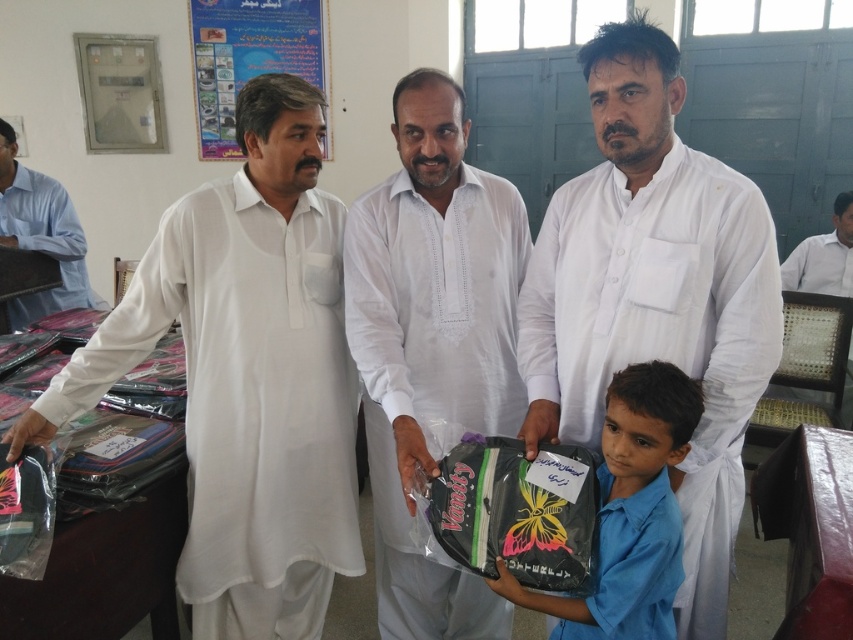
Based on the photo, you are standing in the classroom and need to place a small object exactly at the point closer to the camera between the two points, point 1 at coordinates (676, 189) and point 2 at coordinates (810, 276). Which point should you choose?

You should choose point 1 at coordinates (676, 189) because it is in front of point 2 at coordinates (810, 276), making it closer to the camera.

Based on the scene description, where is the white matte shirt at center located in terms of its 2D coordinates?

The white matte shirt at center is located at the 2D coordinates of point (654,296).